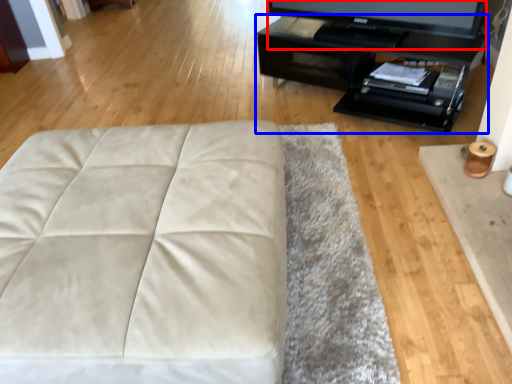
Question: Among these objects, which one is farthest to the camera, television (highlighted by a red box) or table (highlighted by a blue box)?

Choices:
 (A) television
 (B) table

Answer: (A)